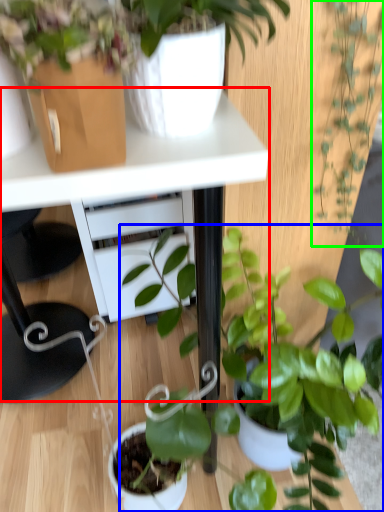
Question: Which is farther away from table (highlighted by a red box)? houseplant (highlighted by a blue box) or houseplant (highlighted by a green box)?

Choices:
 (A) houseplant
 (B) houseplant

Answer: (A)